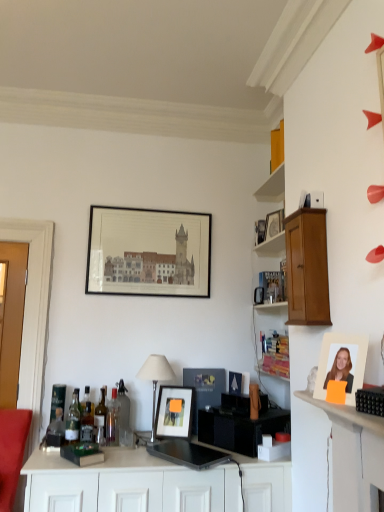
Locate an element on the screen. This screenshot has width=384, height=512. matte black picture frame at upper center, marked as the first picture frame in a back-to-front arrangement is located at coordinates click(x=148, y=252).

Locate an element on the screen. clear glass bottle at center, the 7th bottle in the left-to-right sequence is located at coordinates (123, 405).

This screenshot has width=384, height=512. Describe the element at coordinates (87, 424) in the screenshot. I see `translucent glass bottle at center, marked as the 4th bottle in a right-to-left arrangement` at that location.

Describe the element at coordinates (204, 389) in the screenshot. I see `matte black picture frame at center, placed as the first picture frame when sorted from bottom to top` at that location.

The width and height of the screenshot is (384, 512). What are the coordinates of `matte black picture frame at upper center, marked as the first picture frame in a back-to-front arrangement` in the screenshot? It's located at (148, 252).

Is matte black picture frame at center, placed as the third picture frame when sorted from top to bottom, next to translucent glass bottle at center, the 2th bottle when ordered from right to left, and touching it?

No, matte black picture frame at center, placed as the third picture frame when sorted from top to bottom, is not making contact with translucent glass bottle at center, the 2th bottle when ordered from right to left.

Considering the sizes of objects matte black picture frame at center, which is counted as the third picture frame, starting from the left, and translucent glass bottle at center, the 2th bottle when ordered from right to left, in the image provided, who is shorter, matte black picture frame at center, which is counted as the third picture frame, starting from the left, or translucent glass bottle at center, the 2th bottle when ordered from right to left,?

matte black picture frame at center, which is counted as the third picture frame, starting from the left.

Is matte black picture frame at center, acting as the second picture frame starting from the right, smaller than translucent glass bottle at center, the 2th bottle when ordered from right to left?

Yes, matte black picture frame at center, acting as the second picture frame starting from the right, is smaller than translucent glass bottle at center, the 2th bottle when ordered from right to left.

In terms of width, does matte black picture frame at center, the 3th picture frame from the back, look wider or thinner when compared to translucent glass bottle at center, marked as the 6th bottle in a left-to-right arrangement?

In the image, matte black picture frame at center, the 3th picture frame from the back, appears to be more narrow than translucent glass bottle at center, marked as the 6th bottle in a left-to-right arrangement.

Which point is more distant from viewer, (124, 409) or (258, 275)?

The point (258, 275) is farther.

Can you confirm if clear glass bottle at center, arranged as the 1th bottle when viewed from the right, is positioned to the right of wooden cabinet at upper right?

No.

Considering the relative sizes of clear glass bottle at center, the 7th bottle in the left-to-right sequence, and wooden cabinet at upper right in the image provided, is clear glass bottle at center, the 7th bottle in the left-to-right sequence, bigger than wooden cabinet at upper right?

Incorrect, clear glass bottle at center, the 7th bottle in the left-to-right sequence, is not larger than wooden cabinet at upper right.

Can translucent glass bottle at left, marked as the second bottle in a left-to-right arrangement, be found inside translucent glass bottle at center left, which is the third bottle in left-to-right order?

That's incorrect, translucent glass bottle at left, marked as the second bottle in a left-to-right arrangement, is not inside translucent glass bottle at center left, which is the third bottle in left-to-right order.

From the image's perspective, is translucent glass bottle at center left, which is the fifth bottle from right to left, beneath translucent glass bottle at left, positioned as the sixth bottle in right-to-left order?

No, from the image's perspective, translucent glass bottle at center left, which is the fifth bottle from right to left, is not below translucent glass bottle at left, positioned as the sixth bottle in right-to-left order.

Is translucent glass bottle at center left, which is the third bottle in left-to-right order, to the left of translucent glass bottle at left, marked as the second bottle in a left-to-right arrangement, from the viewer's perspective?

No, translucent glass bottle at center left, which is the third bottle in left-to-right order, is not to the left of translucent glass bottle at left, marked as the second bottle in a left-to-right arrangement.

Is wooden cabinet at upper right bigger than matte black picture frame at upper center, marked as the first picture frame in a back-to-front arrangement?

Actually, wooden cabinet at upper right might be smaller than matte black picture frame at upper center, marked as the first picture frame in a back-to-front arrangement.

Considering the sizes of objects wooden cabinet at upper right and matte black picture frame at upper center, positioned as the fourth picture frame in right-to-left order, in the image provided, who is taller, wooden cabinet at upper right or matte black picture frame at upper center, positioned as the fourth picture frame in right-to-left order,?

matte black picture frame at upper center, positioned as the fourth picture frame in right-to-left order, is taller.

Can you confirm if wooden cabinet at upper right is positioned to the left of matte black picture frame at upper center, positioned as the 1th picture frame in top-to-bottom order?

No, wooden cabinet at upper right is not to the left of matte black picture frame at upper center, positioned as the 1th picture frame in top-to-bottom order.

The height and width of the screenshot is (512, 384). I want to click on the 4th picture frame counting from the left side of the wooden cabinet at upper right, so [148, 252].

Who is taller, clear glass bottle at center, arranged as the 1th bottle when viewed from the right, or green glass bottle at left, acting as the first bottle starting from the left?

With more height is clear glass bottle at center, arranged as the 1th bottle when viewed from the right.

Which is closer to the camera, (128, 411) or (59, 415)?

The point (59, 415) is closer to the camera.

The width and height of the screenshot is (384, 512). Find the location of `the 1st bottle below the clear glass bottle at center, arranged as the 1th bottle when viewed from the right (from a real-world perspective)`. the 1st bottle below the clear glass bottle at center, arranged as the 1th bottle when viewed from the right (from a real-world perspective) is located at coordinates (58, 402).

Is clear glass bottle at center, arranged as the 1th bottle when viewed from the right, far from green glass bottle at left, the 7th bottle viewed from the right?

clear glass bottle at center, arranged as the 1th bottle when viewed from the right, is near green glass bottle at left, the 7th bottle viewed from the right, not far away.

Is clear glass bottle at center, arranged as the 1th bottle when viewed from the right, further to the viewer compared to silver metallic table lamp at center?

Yes, clear glass bottle at center, arranged as the 1th bottle when viewed from the right, is further from the camera.

From their relative heights in the image, would you say clear glass bottle at center, the 7th bottle in the left-to-right sequence, is taller or shorter than silver metallic table lamp at center?

Considering their sizes, clear glass bottle at center, the 7th bottle in the left-to-right sequence, has less height than silver metallic table lamp at center.

Is clear glass bottle at center, arranged as the 1th bottle when viewed from the right, not close to silver metallic table lamp at center?

They are positioned close to each other.

Considering the positions of objects clear glass bottle at center, the 7th bottle in the left-to-right sequence, and translucent glass bottle at center, marked as the 6th bottle in a left-to-right arrangement, in the image provided, who is more to the left, clear glass bottle at center, the 7th bottle in the left-to-right sequence, or translucent glass bottle at center, marked as the 6th bottle in a left-to-right arrangement,?

translucent glass bottle at center, marked as the 6th bottle in a left-to-right arrangement, is more to the left.

Considering the sizes of clear glass bottle at center, arranged as the 1th bottle when viewed from the right, and translucent glass bottle at center, marked as the 6th bottle in a left-to-right arrangement, in the image, is clear glass bottle at center, arranged as the 1th bottle when viewed from the right, wider or thinner than translucent glass bottle at center, marked as the 6th bottle in a left-to-right arrangement,?

Considering their sizes, clear glass bottle at center, arranged as the 1th bottle when viewed from the right, looks slimmer than translucent glass bottle at center, marked as the 6th bottle in a left-to-right arrangement.

Does point (124, 387) come closer to viewer compared to point (106, 429)?

No.

I want to click on bottle that appears on the right of translucent glass bottle at center, the 2th bottle when ordered from right to left, so click(x=123, y=405).

Find the location of a particular element. This screenshot has width=384, height=512. the 2nd bottle positioned below the matte black picture frame at center, which is counted as the third picture frame, starting from the left (from the image's perspective) is located at coordinates (113, 420).

Where is `shelf above the clear glass bottle at center, arranged as the 1th bottle when viewed from the right (from a real-world perspective)`? This screenshot has height=512, width=384. shelf above the clear glass bottle at center, arranged as the 1th bottle when viewed from the right (from a real-world perspective) is located at coordinates (273, 284).

Considering their positions, is matte black picture frame at center, the second picture frame in the front-to-back sequence, positioned closer to translucent glass bottle at center left, which is the third bottle in left-to-right order, than light brown wood cabinet at upper right?

matte black picture frame at center, the second picture frame in the front-to-back sequence, is positioned closer to the anchor translucent glass bottle at center left, which is the third bottle in left-to-right order.

Estimate the real-world distances between objects in this image. Which object is further from translucent glass bottle at center, the fourth bottle from the left, light brown wood cabinet at upper right or silver metallic table lamp at center?

The object further to translucent glass bottle at center, the fourth bottle from the left, is light brown wood cabinet at upper right.

Estimate the real-world distances between objects in this image. Which object is further from clear glass bottle at center, arranged as the 1th bottle when viewed from the right, translucent glass bottle at left, positioned as the sixth bottle in right-to-left order, or translucent glass bottle at center, the third bottle in the right-to-left sequence?

translucent glass bottle at left, positioned as the sixth bottle in right-to-left order, lies further to clear glass bottle at center, arranged as the 1th bottle when viewed from the right, than the other object.

Consider the image. When comparing their distances from translucent glass bottle at left, positioned as the sixth bottle in right-to-left order, does translucent glass bottle at center, marked as the 6th bottle in a left-to-right arrangement, or green glass bottle at left, the 7th bottle viewed from the right, seem closer?

Based on the image, green glass bottle at left, the 7th bottle viewed from the right, appears to be nearer to translucent glass bottle at left, positioned as the sixth bottle in right-to-left order.

Estimate the real-world distances between objects in this image. Which object is closer to translucent glass bottle at center, the 2th bottle when ordered from right to left, silver metallic table lamp at center or clear glass bottle at center, arranged as the 1th bottle when viewed from the right?

Based on the image, clear glass bottle at center, arranged as the 1th bottle when viewed from the right, appears to be nearer to translucent glass bottle at center, the 2th bottle when ordered from right to left.

Based on the photo, when comparing their distances from wooden cabinet at upper right, does matte black picture frame at center, placed as the first picture frame when sorted from bottom to top, or translucent glass bottle at left, marked as the second bottle in a left-to-right arrangement, seem further?

translucent glass bottle at left, marked as the second bottle in a left-to-right arrangement, is positioned further to the anchor wooden cabinet at upper right.

When comparing their distances from matte black picture frame at center, the third picture frame from the front, does wooden cabinet at upper right or green glass bottle at left, acting as the first bottle starting from the left, seem further?

Based on the image, green glass bottle at left, acting as the first bottle starting from the left, appears to be further to matte black picture frame at center, the third picture frame from the front.

From the image, which object appears to be farther from light brown wood cabinet at upper right, translucent glass bottle at center left, which is the third bottle in left-to-right order, or wooden cabinet at upper right?

Based on the image, translucent glass bottle at center left, which is the third bottle in left-to-right order, appears to be further to light brown wood cabinet at upper right.

This screenshot has height=512, width=384. I want to click on table lamp between green glass bottle at left, acting as the first bottle starting from the left, and light brown wood cabinet at upper right, so click(155, 378).

I want to click on shelf positioned between light brown wood cabinet at upper right and matte black picture frame at upper center, positioned as the 1th picture frame in top-to-bottom order, from near to far, so [273, 284].

Find the location of `table lamp between light brown wood cabinet at upper right and matte black picture frame at center, the third picture frame from the front, in the up-down direction`. table lamp between light brown wood cabinet at upper right and matte black picture frame at center, the third picture frame from the front, in the up-down direction is located at coordinates (155, 378).

The image size is (384, 512). What are the coordinates of `table lamp between translucent glass bottle at left, positioned as the sixth bottle in right-to-left order, and light brown wood cabinet at upper right` in the screenshot? It's located at (155, 378).